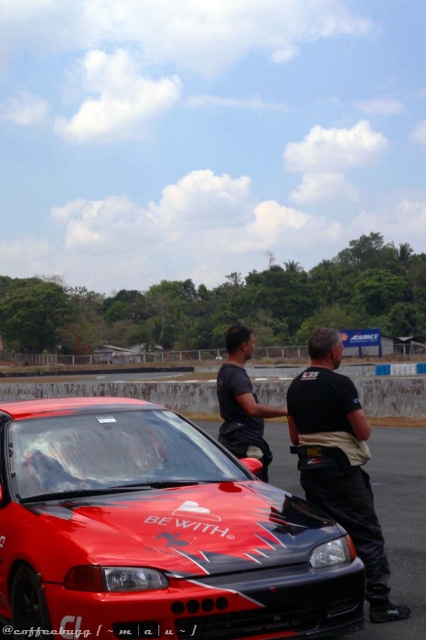
You are standing at the point closer to the camera in this scene. Which point are you at, point (330, 384) or point (132, 637)?

You are at point (330, 384) because it is further to the camera than point (132, 637).

You are a photographer at the racetrack and want to capture a photo of the two people in the middle. The black leather jacket at center and the black matte shirt at center are both in frame. Which clothing item takes up more space in the photo?

The black matte shirt at center takes up more space in the photo because it is larger than the black leather jacket at center.

You are a photographer at the racetrack and need to capture both the black leather jacket at center and the black matte shirt at center in a single frame. Which clothing item is shorter in height?

The black leather jacket at center is not as tall as the black matte shirt at center, so the black leather jacket at center is shorter in height.